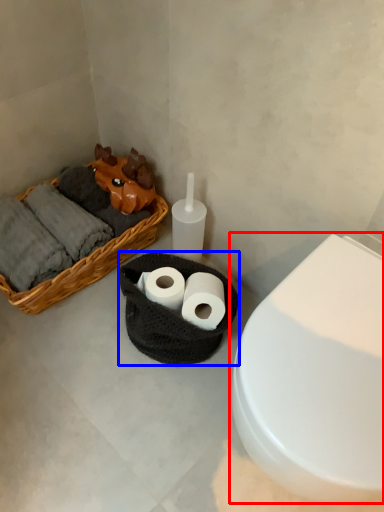
Question: Which object appears farthest to the camera in this image, toilet (highlighted by a red box) or basket container (highlighted by a blue box)?

Choices:
 (A) toilet
 (B) basket container

Answer: (B)